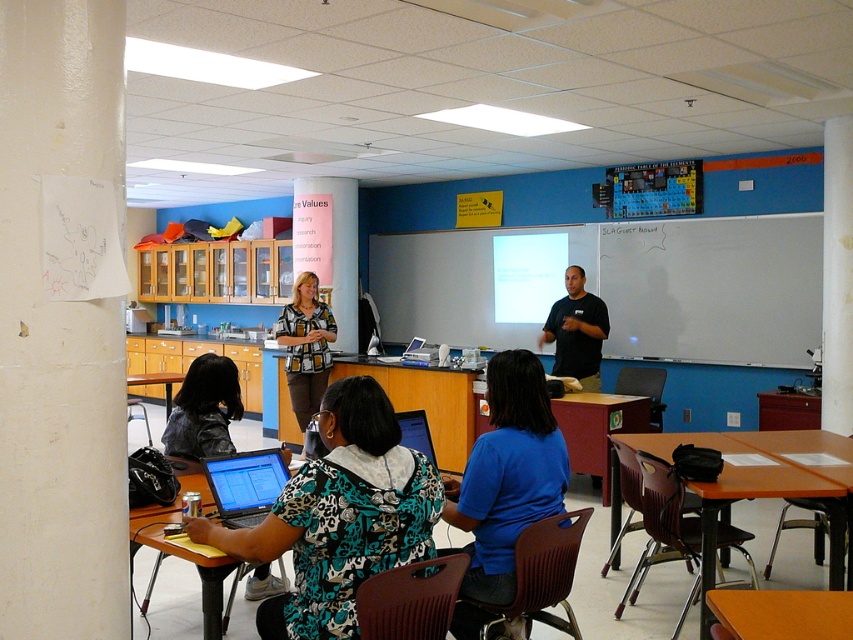
You are a student in the classroom and need to write something on the whiteboard at upper center. Can you reach it from the orange matte table at lower right?

The whiteboard at upper center is taller than the orange matte table at lower right, so you can reach the whiteboard at upper center from the orange matte table at lower right because it is higher than the table.

Looking at this image, in the classroom scene, there is a point marked at coordinates (x=508, y=476). Which object from the list below is this point located on? Choose from the following options based on the scene description provided. The objects are listed as follows exactly as given in the Objects section. The options are blue fabric shirt at center, whiteboard with writing, and student using laptop at front row.

The point at coordinates (x=508, y=476) is located on the blue fabric shirt at center according to the Objects Description provided.